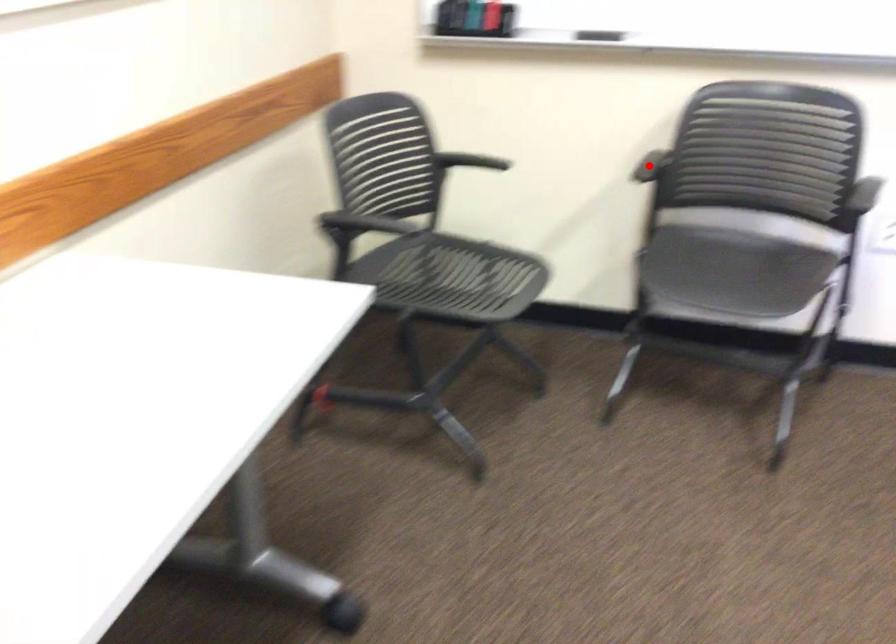
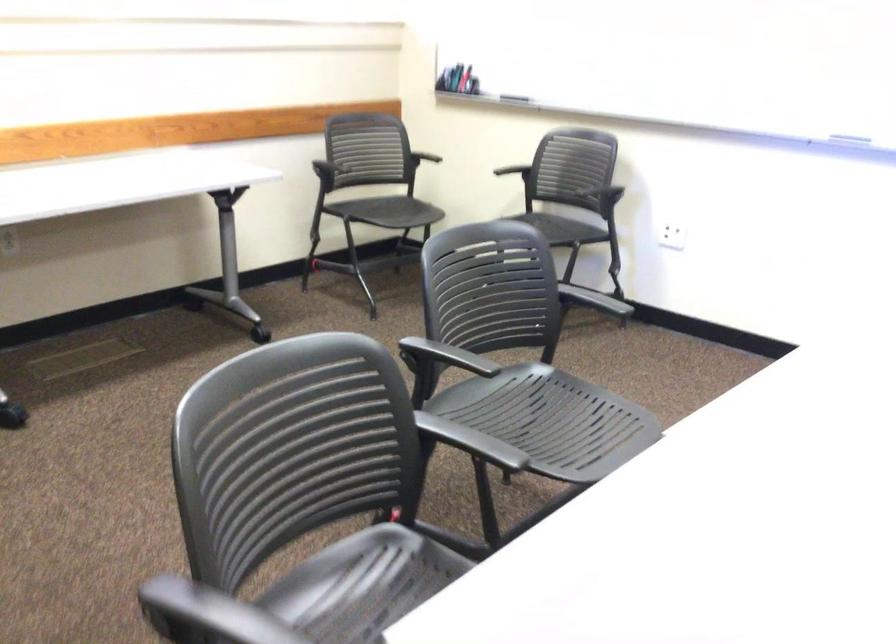
Where in the second image is the point corresponding to the highlighted location from the first image?

(513, 162)